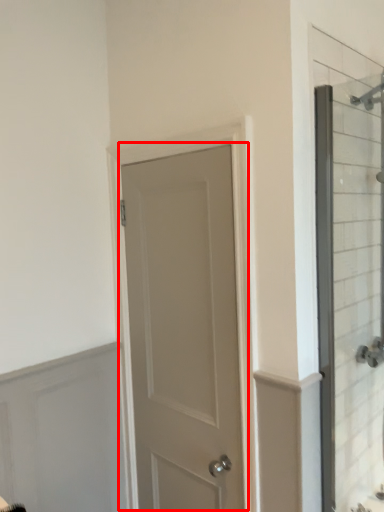
Question: Considering the relative positions of door (annotated by the red box) and glass door in the image provided, where is door (annotated by the red box) located with respect to the staircase?

Choices:
 (A) left
 (B) right

Answer: (A)